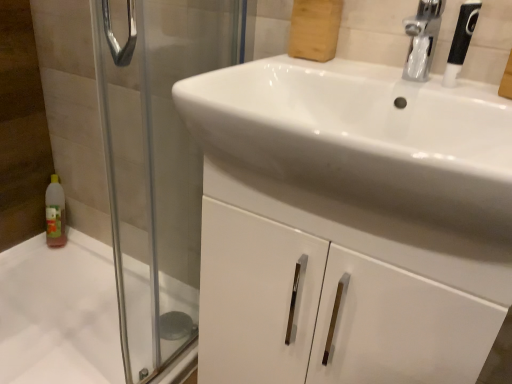
Question: Does transparent glass screen door at left have a larger size compared to white glossy sink at center?

Choices:
 (A) no
 (B) yes

Answer: (A)

Question: Is the position of transparent glass screen door at left more distant than that of white glossy sink at center?

Choices:
 (A) yes
 (B) no

Answer: (A)

Question: Is transparent glass screen door at left oriented away from white glossy sink at center?

Choices:
 (A) no
 (B) yes

Answer: (A)

Question: Does transparent glass screen door at left have a greater width compared to white glossy sink at center?

Choices:
 (A) yes
 (B) no

Answer: (B)

Question: Are transparent glass screen door at left and white glossy sink at center located far from each other?

Choices:
 (A) yes
 (B) no

Answer: (B)

Question: Is transparent glass screen door at left located outside white glossy sink at center?

Choices:
 (A) no
 (B) yes

Answer: (B)

Question: Is white glossy sink at center shorter than white glossy cabinet at center?

Choices:
 (A) yes
 (B) no

Answer: (A)

Question: Is white glossy sink at center smaller than white glossy cabinet at center?

Choices:
 (A) no
 (B) yes

Answer: (B)

Question: Is white glossy sink at center further to the viewer compared to white glossy cabinet at center?

Choices:
 (A) no
 (B) yes

Answer: (A)

Question: Can we say white glossy sink at center lies outside white glossy cabinet at center?

Choices:
 (A) no
 (B) yes

Answer: (B)

Question: From a real-world perspective, is white glossy sink at center over white glossy cabinet at center?

Choices:
 (A) no
 (B) yes

Answer: (B)

Question: Is white glossy sink at center thinner than white glossy cabinet at center?

Choices:
 (A) no
 (B) yes

Answer: (A)

Question: Considering the relative positions of black textured shower head at upper right and transparent glass screen door at left in the image provided, is black textured shower head at upper right to the right of transparent glass screen door at left from the viewer's perspective?

Choices:
 (A) no
 (B) yes

Answer: (B)